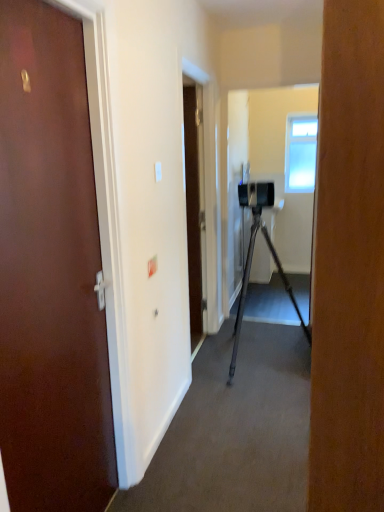
Find the location of a particular element. This screenshot has width=384, height=512. clear glass window at upper center is located at coordinates (300, 154).

This screenshot has width=384, height=512. What do you see at coordinates (300, 154) in the screenshot? I see `clear glass window at upper center` at bounding box center [300, 154].

What do you see at coordinates (50, 272) in the screenshot? The width and height of the screenshot is (384, 512). I see `matte brown door at left` at bounding box center [50, 272].

What is the approximate width of matte brown door at left?

matte brown door at left is 3.16 inches in width.

Find the location of a particular element. matte brown door at left is located at coordinates [x=50, y=272].

At what (x,y) coordinates should I click in order to perform the action: click on clear glass window at upper center. Please return your answer as a coordinate pair (x, y). The height and width of the screenshot is (512, 384). Looking at the image, I should click on (300, 154).

Which object is positioned more to the left, clear glass window at upper center or matte brown door at left?

Positioned to the left is matte brown door at left.

Is clear glass window at upper center further to the viewer compared to matte brown door at left?

That is True.

Is point (293, 116) closer or farther from the camera than point (78, 262)?

Point (293, 116) appears to be farther away from the viewer than point (78, 262).

Consider the image. From the image's perspective, which is below, clear glass window at upper center or matte brown door at left?

matte brown door at left.

From a real-world perspective, is clear glass window at upper center under matte brown door at left?

Incorrect, from a real-world perspective, clear glass window at upper center is higher than matte brown door at left.

Is clear glass window at upper center thinner than matte brown door at left?

Indeed, clear glass window at upper center has a lesser width compared to matte brown door at left.

From their relative heights in the image, would you say clear glass window at upper center is taller or shorter than matte brown door at left?

Clearly, clear glass window at upper center is shorter compared to matte brown door at left.

Considering the sizes of objects clear glass window at upper center and matte brown door at left in the image provided, who is bigger, clear glass window at upper center or matte brown door at left?

matte brown door at left is bigger.

Would you say clear glass window at upper center is inside or outside matte brown door at left?

clear glass window at upper center is spatially situated outside matte brown door at left.

Is clear glass window at upper center not near matte brown door at left?

Yes.

Does clear glass window at upper center turn towards matte brown door at left?

Yes, clear glass window at upper center faces towards matte brown door at left.

Consider the image. How different are the orientations of clear glass window at upper center and matte brown door at left in degrees?

91.1 degrees.

Where is `window located on the right of matte brown door at left`? Image resolution: width=384 pixels, height=512 pixels. window located on the right of matte brown door at left is located at coordinates (300, 154).

Considering the relative positions of matte brown door at left and clear glass window at upper center in the image provided, is matte brown door at left to the left or to the right of clear glass window at upper center?

Clearly, matte brown door at left is on the left of clear glass window at upper center in the image.

Consider the image. Which object is further away from the camera taking this photo, matte brown door at left or clear glass window at upper center?

clear glass window at upper center is more distant.

Between point (17, 130) and point (299, 121), which one is positioned in front?

Point (17, 130)

From the image's perspective, which is below, matte brown door at left or clear glass window at upper center?

matte brown door at left appears lower in the image.

From a real-world perspective, is matte brown door at left positioned under clear glass window at upper center based on gravity?

Indeed, from a real-world perspective, matte brown door at left is positioned beneath clear glass window at upper center.

Between matte brown door at left and clear glass window at upper center, which one has smaller width?

With smaller width is clear glass window at upper center.

Who is taller, matte brown door at left or clear glass window at upper center?

With more height is matte brown door at left.

Can you confirm if matte brown door at left is bigger than clear glass window at upper center?

Indeed, matte brown door at left has a larger size compared to clear glass window at upper center.

Choose the correct answer: Is matte brown door at left inside clear glass window at upper center or outside it?

matte brown door at left is spatially situated outside clear glass window at upper center.

Are matte brown door at left and clear glass window at upper center making contact?

matte brown door at left and clear glass window at upper center are clearly separated.

Based on the photo, is matte brown door at left positioned with its back to clear glass window at upper center?

matte brown door at left does not have its back to clear glass window at upper center.

How different are the orientations of matte brown door at left and clear glass window at upper center in degrees?

91.1 degrees separate the facing orientations of matte brown door at left and clear glass window at upper center.

Identify the location of window above the matte brown door at left (from a real-world perspective). Image resolution: width=384 pixels, height=512 pixels. (300, 154).

The image size is (384, 512). Identify the location of door that is under the clear glass window at upper center (from a real-world perspective). (50, 272).

Where is `door below the clear glass window at upper center (from the image's perspective)`? Image resolution: width=384 pixels, height=512 pixels. door below the clear glass window at upper center (from the image's perspective) is located at coordinates (50, 272).